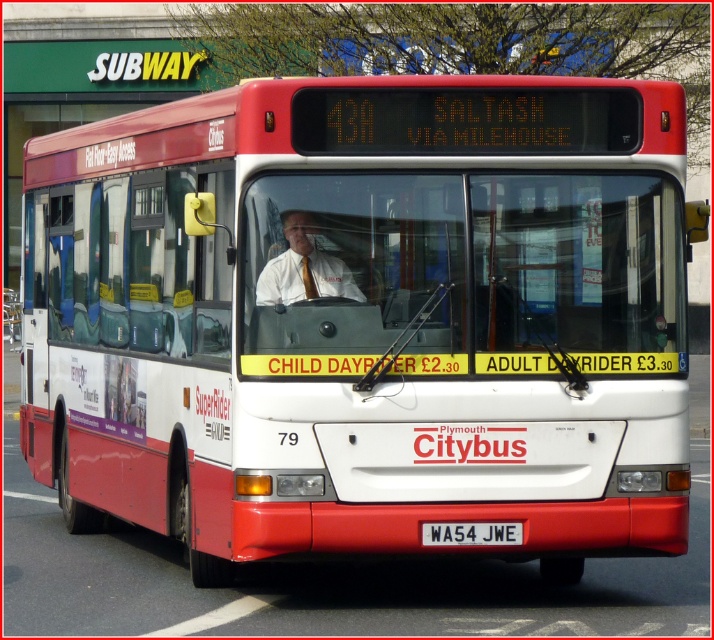
Does matte white shirt at center have a larger size compared to white plastic license plate at center?

Correct, matte white shirt at center is larger in size than white plastic license plate at center.

This screenshot has height=640, width=714. What do you see at coordinates (303, 268) in the screenshot? I see `matte white shirt at center` at bounding box center [303, 268].

Find the location of a particular element. Image resolution: width=714 pixels, height=640 pixels. matte white shirt at center is located at coordinates (303, 268).